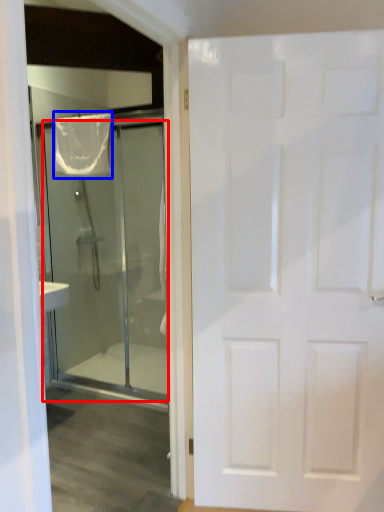
Question: Among these objects, which one is nearest to the camera, door (highlighted by a red box) or shower curtain (highlighted by a blue box)?

Choices:
 (A) door
 (B) shower curtain

Answer: (A)